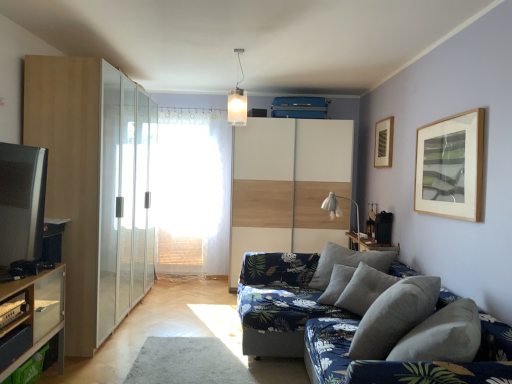
In order to face white wood dresser at center, positioned as the 2th dresser in left-to-right order, should I rotate leftwards or rightwards?

Turn right by 4.617 degrees to look at white wood dresser at center, positioned as the 2th dresser in left-to-right order.

What is the approximate height of matte glass cabinet at left, the 1th dresser when ordered from front to back?

matte glass cabinet at left, the 1th dresser when ordered from front to back, is 2.39 meters tall.

At what (x,y) coordinates should I click in order to perform the action: click on matte glass cabinet at left, the first dresser in the left-to-right sequence. Please return your answer as a coordinate pair (x, y). The width and height of the screenshot is (512, 384). Looking at the image, I should click on (96, 186).

This screenshot has width=512, height=384. Find the location of `transparent glass screen door at left`. transparent glass screen door at left is located at coordinates (124, 198).

This screenshot has height=384, width=512. Find the location of `wooden table at right`. wooden table at right is located at coordinates (369, 244).

Measure the distance between point (x=366, y=250) and camera.

They are 4.50 meters apart.

Find the location of a particular element. white glass pendant light at upper center is located at coordinates (237, 101).

Describe the element at coordinates (237, 101) in the screenshot. I see `white glass pendant light at upper center` at that location.

Image resolution: width=512 pixels, height=384 pixels. I want to click on wooden framed artwork at upper right, so click(383, 142).

Image resolution: width=512 pixels, height=384 pixels. I want to click on white wood dresser at center, positioned as the second dresser in front-to-back order, so click(288, 186).

How different are the orientations of gray fabric pillow at lower right and wooden shelf at lower left in degrees?

151 degrees.

Locate an element on the screen. Image resolution: width=512 pixels, height=384 pixels. pillow located on the right of wooden shelf at lower left is located at coordinates (394, 316).

Considering the relative positions of gray fabric pillow at lower right and wooden shelf at lower left in the image provided, is gray fabric pillow at lower right to the right of wooden shelf at lower left from the viewer's perspective?

Indeed, gray fabric pillow at lower right is positioned on the right side of wooden shelf at lower left.

Between point (438, 288) and point (54, 280), which one is positioned behind?

The point (54, 280) is farther from the camera.

Does wooden shelf at lower left appear on the right side of transparent glass screen door at left?

No.

From a real-world perspective, which object stands above the other?

transparent glass screen door at left.

Is wooden shelf at lower left facing away from transparent glass screen door at left?

wooden shelf at lower left does not have its back to transparent glass screen door at left.

Is white fabric lampshade at upper center situated inside gray fabric pillow at lower right or outside?

white fabric lampshade at upper center exists outside the volume of gray fabric pillow at lower right.

You are a GUI agent. You are given a task and a screenshot of the screen. Output one action in this format:
    pyautogui.click(x=<x>, y=<y>)
    Task: Click on the pillow in front of the white fabric lampshade at upper center
    The width and height of the screenshot is (512, 384).
    Given the screenshot: What is the action you would take?
    pyautogui.click(x=394, y=316)

Consider the image. From a real-world perspective, who is located lower, white fabric lampshade at upper center or gray fabric pillow at lower right?

In real-world perspective, gray fabric pillow at lower right is lower.

Visually, is white fabric lampshade at upper center positioned to the left or to the right of gray fabric pillow at lower right?

white fabric lampshade at upper center is to the right of gray fabric pillow at lower right.

Is white fabric lampshade at upper center situated inside blue floral fabric couch at lower right or outside?

The correct answer is: outside.

Can you confirm if white fabric lampshade at upper center is positioned to the right of blue floral fabric couch at lower right?

Yes.

From a real-world perspective, which is physically above, white fabric lampshade at upper center or blue floral fabric couch at lower right?

white fabric lampshade at upper center, from a real-world perspective.

Does white fabric lampshade at upper center touch wooden table at right?

No, white fabric lampshade at upper center is not next to wooden table at right.

Does white fabric lampshade at upper center turn towards wooden table at right?

No, white fabric lampshade at upper center is not facing towards wooden table at right.

Who is more distant, white fabric lampshade at upper center or wooden table at right?

white fabric lampshade at upper center is further from the camera.

How many degrees apart are the facing directions of white fabric lampshade at upper center and wooden table at right?

They differ by 1.71 degrees in their facing directions.

Would you say white glass pendant light at upper center is a long distance from white fabric lampshade at upper center?

white glass pendant light at upper center is positioned a significant distance from white fabric lampshade at upper center.

Can we say white glass pendant light at upper center lies outside white fabric lampshade at upper center?

Yes, white glass pendant light at upper center is not within white fabric lampshade at upper center.

From the image's perspective, relative to white fabric lampshade at upper center, is white glass pendant light at upper center above or below?

Based on their image positions, white glass pendant light at upper center is located above white fabric lampshade at upper center.

Is white glass pendant light at upper center positioned with its back to white fabric lampshade at upper center?

white glass pendant light at upper center does not have its back to white fabric lampshade at upper center.

Is wooden table at right in front of or behind white fabric lampshade at upper center in the image?

Clearly, wooden table at right is in front of white fabric lampshade at upper center.

At what (x,y) coordinates should I click in order to perform the action: click on light that appears above the wooden table at right (from a real-world perspective). Please return your answer as a coordinate pair (x, y). The height and width of the screenshot is (384, 512). Looking at the image, I should click on (340, 210).

From a real-world perspective, which is physically above, wooden table at right or white fabric lampshade at upper center?

From a 3D spatial view, white fabric lampshade at upper center is above.

Does wooden table at right appear on the left side of white fabric lampshade at upper center?

No, wooden table at right is not to the left of white fabric lampshade at upper center.

Locate an element on the screen. pillow above the wooden shelf at lower left (from a real-world perspective) is located at coordinates (394, 316).

Identify the location of screen door on the right side of wooden shelf at lower left. Image resolution: width=512 pixels, height=384 pixels. (124, 198).

Looking at the image, which one is located further to frosted glass window screen at center, white fabric lampshade at upper center or white wood dresser at center, which is counted as the first dresser, starting from the right?

white fabric lampshade at upper center.

Looking at this image, looking at the image, which one is located closer to wooden framed artwork at upper right, blue floral fabric couch at lower right or transparent glass screen door at left?

blue floral fabric couch at lower right lies closer to wooden framed artwork at upper right than the other object.

Which object lies further to the anchor point white glass pendant light at upper center, blue floral fabric couch at lower right or wooden shelf at lower left?

wooden shelf at lower left lies further to white glass pendant light at upper center than the other object.

From the image, which object appears to be farther from wooden shelf at lower left, frosted glass window screen at center or wooden table at right?

Among the two, frosted glass window screen at center is located further to wooden shelf at lower left.

When comparing their distances from transparent glass screen door at left, does frosted glass window screen at center or white glass pendant light at upper center seem closer?

Based on the image, frosted glass window screen at center appears to be nearer to transparent glass screen door at left.

Looking at the image, which one is located further to wooden shelf at lower left, transparent glass screen door at left or frosted glass window screen at center?

The object further to wooden shelf at lower left is frosted glass window screen at center.

Considering their positions, is transparent glass screen door at left positioned further to wooden table at right than wooden framed artwork at upper right?

transparent glass screen door at left.

Looking at the image, which one is located further to frosted glass window screen at center, matte glass cabinet at left, positioned as the 2th dresser in back-to-front order, or white wood dresser at center, marked as the 1th dresser in a back-to-front arrangement?

matte glass cabinet at left, positioned as the 2th dresser in back-to-front order, is positioned further to the anchor frosted glass window screen at center.

Where is `light between matte glass cabinet at left, positioned as the 2th dresser in back-to-front order, and wooden framed artwork at upper right`? The width and height of the screenshot is (512, 384). light between matte glass cabinet at left, positioned as the 2th dresser in back-to-front order, and wooden framed artwork at upper right is located at coordinates (340, 210).

Locate an element on the screen. The image size is (512, 384). studio couch located between transparent glass screen door at left and wooden framed artwork at upper right in the left-right direction is located at coordinates (289, 313).

This screenshot has height=384, width=512. Find the location of `pillow situated between wooden shelf at lower left and blue floral fabric couch at lower right from left to right`. pillow situated between wooden shelf at lower left and blue floral fabric couch at lower right from left to right is located at coordinates (394, 316).

I want to click on light fixture between wooden shelf at lower left and gray fabric pillow at lower right in the horizontal direction, so click(237, 101).